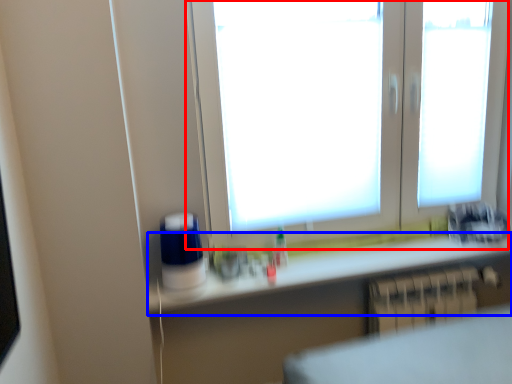
Question: Which of the following is the closest to the observer, window (highlighted by a red box) or counter top (highlighted by a blue box)?

Choices:
 (A) window
 (B) counter top

Answer: (A)